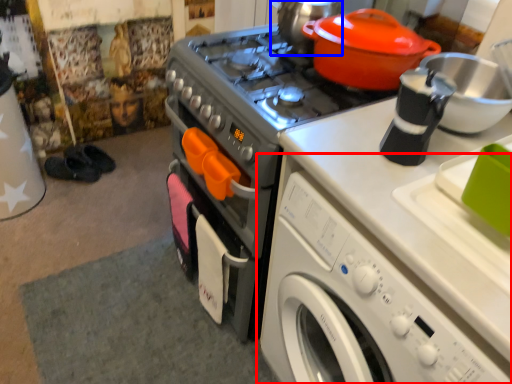
Question: Among these objects, which one is nearest to the camera, washing machine (highlighted by a red box) or tea pot (highlighted by a blue box)?

Choices:
 (A) washing machine
 (B) tea pot

Answer: (A)